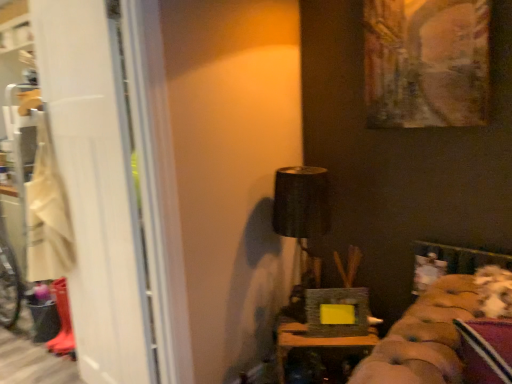
Question: Can we say white matte screen door at left lies outside beige fabric laundry at left?

Choices:
 (A) yes
 (B) no

Answer: (A)

Question: Considering the relative sizes of white matte screen door at left and beige fabric laundry at left in the image provided, is white matte screen door at left shorter than beige fabric laundry at left?

Choices:
 (A) yes
 (B) no

Answer: (B)

Question: Can you confirm if white matte screen door at left is thinner than beige fabric laundry at left?

Choices:
 (A) yes
 (B) no

Answer: (A)

Question: Does white matte screen door at left have a greater height compared to beige fabric laundry at left?

Choices:
 (A) yes
 (B) no

Answer: (A)

Question: Does white matte screen door at left turn towards beige fabric laundry at left?

Choices:
 (A) yes
 (B) no

Answer: (A)

Question: From the image's perspective, is oil painting at upper right, arranged as the second picture frame when ordered from the bottom, located above or below matte black picture frame at center, acting as the second picture frame starting from the top?

Choices:
 (A) above
 (B) below

Answer: (A)

Question: Looking at their shapes, would you say oil painting at upper right, which ranks as the 2th picture frame in left-to-right order, is wider or thinner than matte black picture frame at center, acting as the second picture frame starting from the top?

Choices:
 (A) thin
 (B) wide

Answer: (A)

Question: From a real-world perspective, is oil painting at upper right, the 1th picture frame in the top-to-bottom sequence, positioned above or below matte black picture frame at center, which is the second picture frame from right to left?

Choices:
 (A) below
 (B) above

Answer: (B)

Question: Would you say oil painting at upper right, which ranks as the 1th picture frame in right-to-left order, is to the left or to the right of matte black picture frame at center, positioned as the 1th picture frame in bottom-to-top order, in the picture?

Choices:
 (A) right
 (B) left

Answer: (A)

Question: Considering the positions of point (352, 324) and point (54, 218), is point (352, 324) closer or farther from the camera than point (54, 218)?

Choices:
 (A) closer
 (B) farther

Answer: (A)

Question: From a real-world perspective, relative to beige fabric laundry at left, is matte black picture frame at center, which is the first picture frame in left-to-right order, vertically above or below?

Choices:
 (A) below
 (B) above

Answer: (A)

Question: Is matte black picture frame at center, acting as the second picture frame starting from the top, in front of or behind beige fabric laundry at left in the image?

Choices:
 (A) behind
 (B) front

Answer: (B)

Question: Based on their sizes in the image, would you say matte black picture frame at center, which is the second picture frame from right to left, is bigger or smaller than beige fabric laundry at left?

Choices:
 (A) small
 (B) big

Answer: (A)

Question: Based on their sizes in the image, would you say white matte screen door at left is bigger or smaller than oil painting at upper right, which ranks as the 2th picture frame in left-to-right order?

Choices:
 (A) big
 (B) small

Answer: (A)

Question: In the image, is white matte screen door at left on the left side or the right side of oil painting at upper right, the 1th picture frame in the top-to-bottom sequence?

Choices:
 (A) left
 (B) right

Answer: (A)